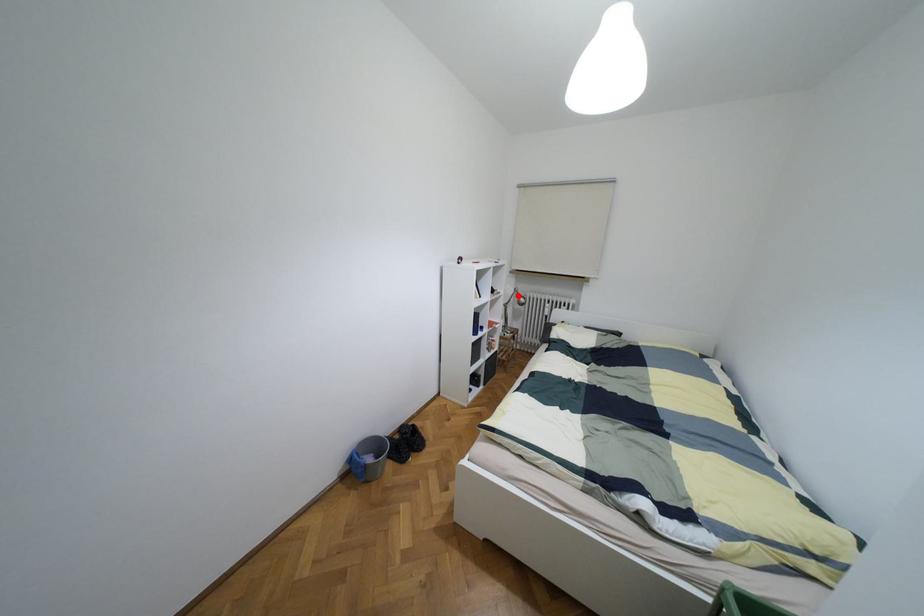
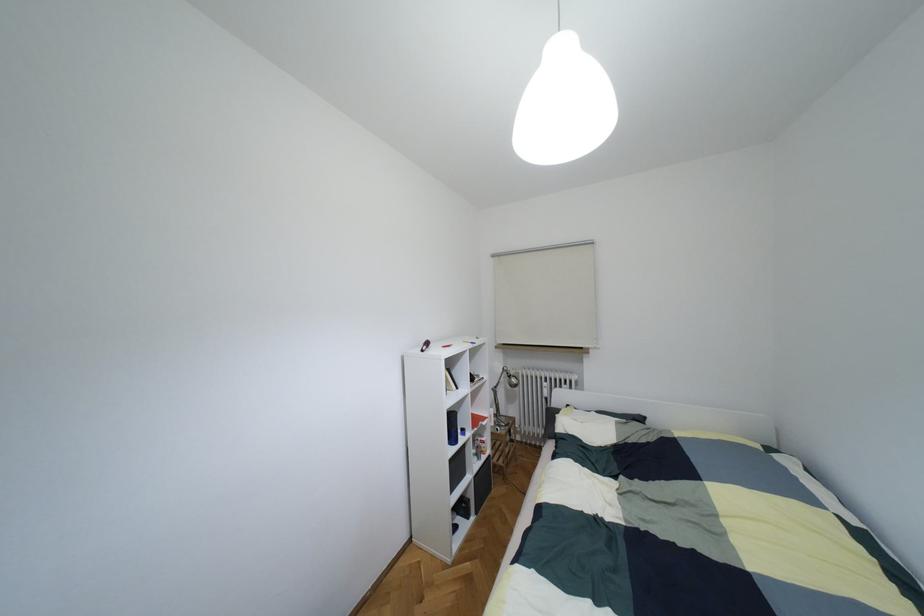
Question: A red point is marked in image1. In image2, is the corresponding 3D point closer to the camera or farther? Reply with the corresponding letter.

Choices:
 (A) The corresponding 3D point is closer.
 (B) The corresponding 3D point is farther.

Answer: (B)